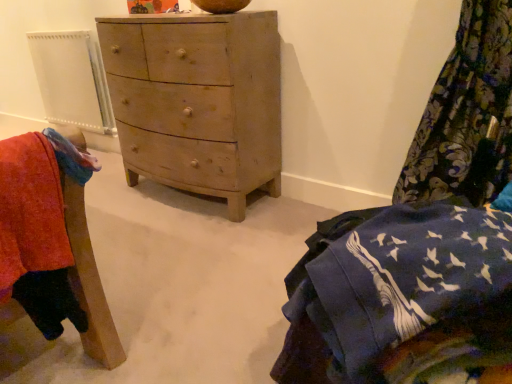
What is the approximate width of floral fabric curtain at right?

15.82 inches.

Find the location of a particular element. floral fabric curtain at right is located at coordinates (466, 115).

At what (x,y) coordinates should I click in order to perform the action: click on white plastic radiator at left. Please return your answer as a coordinate pair (x, y). Image resolution: width=512 pixels, height=384 pixels. Looking at the image, I should click on (72, 80).

Image resolution: width=512 pixels, height=384 pixels. I want to click on blue cotton blanket at lower right, so click(x=401, y=298).

Find the location of a particular element. The image size is (512, 384). floral fabric curtain at right is located at coordinates (466, 115).

Which is more to the left, white plastic radiator at left or wooden chest of drawers at center?

white plastic radiator at left.

How many degrees apart are the facing directions of white plastic radiator at left and wooden chest of drawers at center?

The angle between the facing direction of white plastic radiator at left and the facing direction of wooden chest of drawers at center is 2.21 degrees.

Is wooden chest of drawers at center a part of white plastic radiator at left?

No, wooden chest of drawers at center is not inside white plastic radiator at left.

From the picture: Is white plastic radiator at left aimed at wooden chest of drawers at center?

No, white plastic radiator at left is not turned towards wooden chest of drawers at center.

Considering the sizes of objects floral fabric curtain at right and wooden chair at lower left in the image provided, who is thinner, floral fabric curtain at right or wooden chair at lower left?

With smaller width is wooden chair at lower left.

Based on their positions, is floral fabric curtain at right located to the left or right of wooden chair at lower left?

From the image, it's evident that floral fabric curtain at right is to the right of wooden chair at lower left.

From the picture: Is floral fabric curtain at right directly adjacent to wooden chair at lower left?

No, floral fabric curtain at right is not next to wooden chair at lower left.

From the image's perspective, which object appears higher, floral fabric curtain at right or wooden chair at lower left?

From the image's view, floral fabric curtain at right is above.

How many degrees apart are the facing directions of wooden chair at lower left and white plastic radiator at left?

The angle between the facing direction of wooden chair at lower left and the facing direction of white plastic radiator at left is 88 degrees.

From the image's perspective, which is below, wooden chair at lower left or white plastic radiator at left?

wooden chair at lower left appears lower in the image.

Is wooden chair at lower left smaller than white plastic radiator at left?

Yes, wooden chair at lower left is smaller than white plastic radiator at left.

Looking at their sizes, would you say wooden chair at lower left is wider or thinner than white plastic radiator at left?

In the image, wooden chair at lower left appears to be wider than white plastic radiator at left.

Based on the photo, is floral fabric curtain at right positioned far away from blue cotton blanket at lower right?

No, floral fabric curtain at right is not far from blue cotton blanket at lower right.

Can you confirm if floral fabric curtain at right is wider than blue cotton blanket at lower right?

No.

How different are the orientations of floral fabric curtain at right and blue cotton blanket at lower right in degrees?

52.8 degrees separate the facing orientations of floral fabric curtain at right and blue cotton blanket at lower right.

Does point (452, 165) come farther from viewer compared to point (456, 222)?

Yes.

Is white plastic radiator at left not near floral fabric curtain at right?

That's right, there is a large distance between white plastic radiator at left and floral fabric curtain at right.

Considering the relative sizes of white plastic radiator at left and floral fabric curtain at right in the image provided, is white plastic radiator at left taller than floral fabric curtain at right?

No.

Which point is more forward, (92, 128) or (502, 27)?

Point (502, 27)

The width and height of the screenshot is (512, 384). In order to click on radiator that is on the left side of floral fabric curtain at right in this screenshot , I will do `click(72, 80)`.

Which object is closer to the camera, blue cotton blanket at lower right or wooden chair at lower left?

blue cotton blanket at lower right is more forward.

Is wooden chair at lower left located within blue cotton blanket at lower right?

That's incorrect, wooden chair at lower left is not inside blue cotton blanket at lower right.

In the scene shown: Measure the distance from blue cotton blanket at lower right to wooden chair at lower left.

blue cotton blanket at lower right is 29.47 inches from wooden chair at lower left.

From a real-world perspective, is wooden chest of drawers at center physically located above or below floral fabric curtain at right?

Clearly, from a real-world perspective, wooden chest of drawers at center is below floral fabric curtain at right.

Is point (271, 155) positioned in front of point (459, 102)?

No, it is behind (459, 102).

From the image's perspective, is wooden chest of drawers at center below floral fabric curtain at right?

Actually, wooden chest of drawers at center appears above floral fabric curtain at right in the image.

Is floral fabric curtain at right inside wooden chest of drawers at center?

No, floral fabric curtain at right is located outside of wooden chest of drawers at center.

Where is `radiator above the wooden chest of drawers at center (from the image's perspective)`? Image resolution: width=512 pixels, height=384 pixels. radiator above the wooden chest of drawers at center (from the image's perspective) is located at coordinates (72, 80).

Locate an element on the screen. curtain above the wooden chair at lower left (from a real-world perspective) is located at coordinates (466, 115).

Estimate the real-world distances between objects in this image. Which object is further from wooden chair at lower left, blue cotton blanket at lower right or white plastic radiator at left?

white plastic radiator at left lies further to wooden chair at lower left than the other object.

Based on their spatial positions, is white plastic radiator at left or wooden chest of drawers at center further from floral fabric curtain at right?

Based on the image, white plastic radiator at left appears to be further to floral fabric curtain at right.

Which object lies nearer to the anchor point wooden chair at lower left, white plastic radiator at left or blue cotton blanket at lower right?

The object closer to wooden chair at lower left is blue cotton blanket at lower right.

Considering their positions, is wooden chest of drawers at center positioned closer to wooden chair at lower left than floral fabric curtain at right?

Among the two, wooden chest of drawers at center is located nearer to wooden chair at lower left.

Considering their positions, is wooden chest of drawers at center positioned further to floral fabric curtain at right than blue cotton blanket at lower right?

The object further to floral fabric curtain at right is wooden chest of drawers at center.

From the image, which object appears to be nearer to white plastic radiator at left, floral fabric curtain at right or blue cotton blanket at lower right?

floral fabric curtain at right is positioned closer to the anchor white plastic radiator at left.

Consider the image. Based on their spatial positions, is blue cotton blanket at lower right or white plastic radiator at left closer to wooden chest of drawers at center?

white plastic radiator at left is closer to wooden chest of drawers at center.

Consider the image. Considering their positions, is wooden chest of drawers at center positioned closer to wooden chair at lower left than white plastic radiator at left?

wooden chest of drawers at center.

Identify the location of curtain between blue cotton blanket at lower right and white plastic radiator at left in the front-back direction. This screenshot has width=512, height=384. (466, 115).

Identify the location of chest of drawers between wooden chair at lower left and floral fabric curtain at right from left to right. The width and height of the screenshot is (512, 384). (197, 101).

The image size is (512, 384). Identify the location of chest of drawers between wooden chair at lower left and white plastic radiator at left from front to back. (197, 101).

What are the coordinates of `the chest of drawers located between blue cotton blanket at lower right and white plastic radiator at left in the depth direction` in the screenshot? It's located at (197, 101).